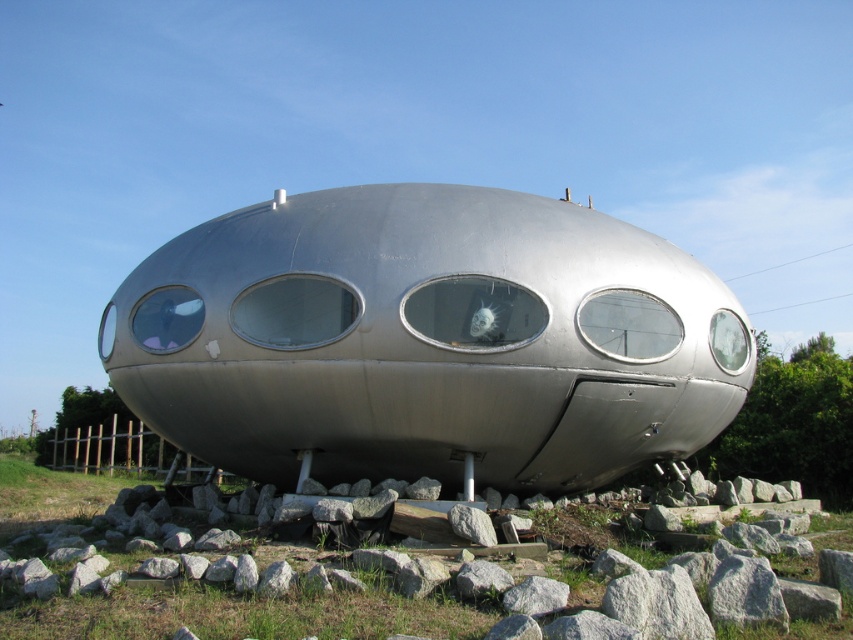
Is metallic silver dome at center below gray rough stone at center?

Actually, metallic silver dome at center is above gray rough stone at center.

Does metallic silver dome at center have a smaller size compared to gray rough stone at center?

Incorrect, metallic silver dome at center is not smaller in size than gray rough stone at center.

Does point (573, 276) lie behind point (492, 531)?

Yes, point (573, 276) is farther from viewer.

Locate an element on the screen. The width and height of the screenshot is (853, 640). metallic silver dome at center is located at coordinates (427, 340).

Is gray rock at lower center positioned at the back of gray rough stone at center?

No, gray rock at lower center is in front of gray rough stone at center.

How much distance is there between gray rock at lower center and gray rough stone at center?

gray rock at lower center is 2.43 meters from gray rough stone at center.

Who is more forward, (642, 552) or (486, 532)?

Positioned in front is point (486, 532).

Locate an element on the screen. Image resolution: width=853 pixels, height=640 pixels. gray rock at lower center is located at coordinates (196, 586).

Which is behind, point (505, 602) or point (482, 529)?

The point (482, 529) is more distant.

Does gray rough rock at center lie in front of gray rough stone at center?

That is True.

The width and height of the screenshot is (853, 640). Identify the location of gray rough rock at center. (537, 596).

The height and width of the screenshot is (640, 853). In order to click on gray rough rock at center in this screenshot , I will do `click(537, 596)`.